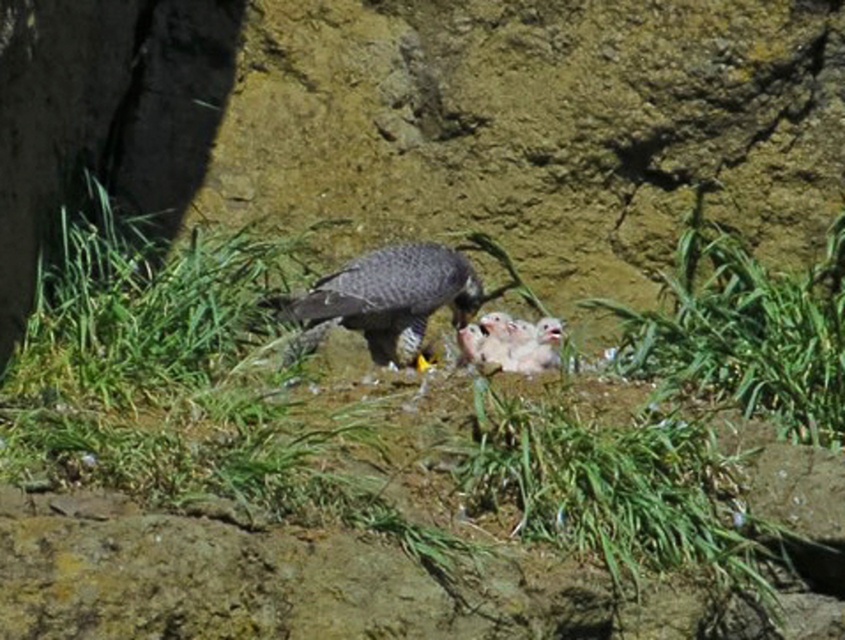
You are a birdwatcher observing the scene. You notice the green grass at center and the soft white downy chicks at center. Which object is located lower in the image?

The green grass at center is located lower than the soft white downy chicks at center.

You are a wildlife photographer observing the scene. You need to capture a photo where both the dark gray speckled falcon at center and the soft white downy chicks at center are clearly visible. Given their size difference, which one might you need to adjust your camera focus on more carefully to ensure clarity?

The soft white downy chicks at center are smaller than the dark gray speckled falcon at center. To ensure clarity, focus more carefully on the smaller chicks since their smaller size might make it harder to capture details clearly in the photo.